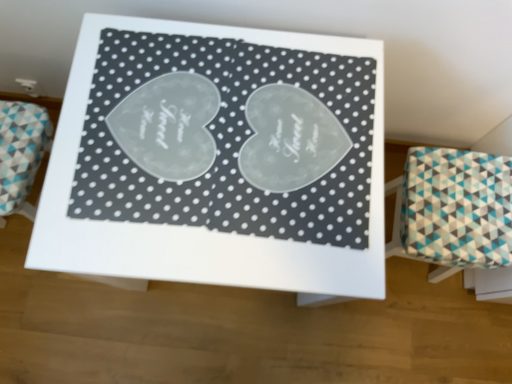
Question: Visually, is white glossy table at center positioned to the left or to the right of teal and white fabric stool at right?

Choices:
 (A) right
 (B) left

Answer: (B)

Question: In terms of height, does white glossy table at center look taller or shorter compared to teal and white fabric stool at right?

Choices:
 (A) tall
 (B) short

Answer: (A)

Question: From a real-world perspective, relative to teal and white fabric stool at right, is white glossy table at center vertically above or below?

Choices:
 (A) above
 (B) below

Answer: (A)

Question: From their relative heights in the image, would you say teal and white fabric stool at right is taller or shorter than white glossy table at center?

Choices:
 (A) short
 (B) tall

Answer: (A)

Question: Looking at the image, does teal and white fabric stool at right seem bigger or smaller compared to white glossy table at center?

Choices:
 (A) big
 (B) small

Answer: (B)

Question: Would you say teal and white fabric stool at right is to the left or to the right of white glossy table at center in the picture?

Choices:
 (A) left
 (B) right

Answer: (B)

Question: From the image's perspective, is teal and white fabric stool at right positioned above or below white glossy table at center?

Choices:
 (A) below
 (B) above

Answer: (A)